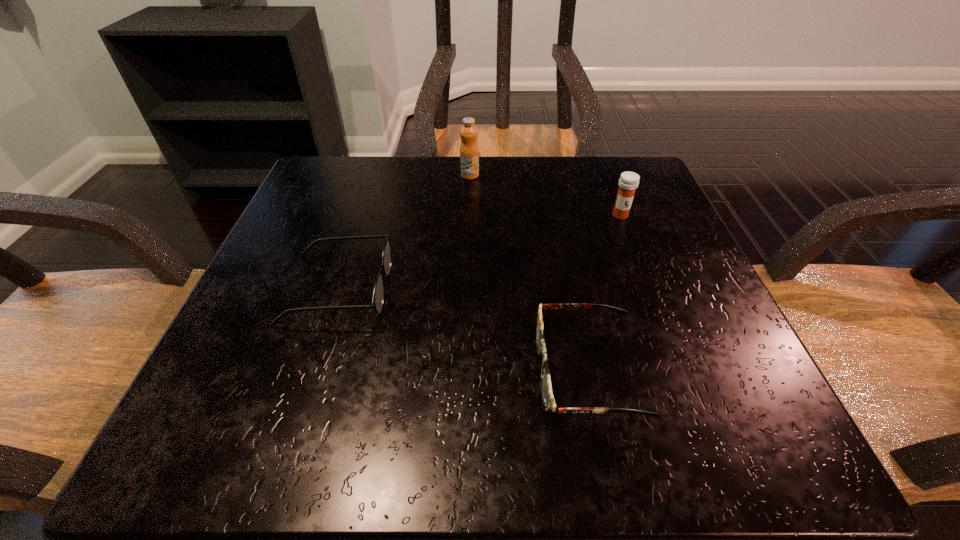
Identify the location of free space at the far edge. Image resolution: width=960 pixels, height=540 pixels. (521, 199).

The width and height of the screenshot is (960, 540). In order to click on blank space at the left edge of the desktop in this screenshot , I will do `click(244, 357)`.

Image resolution: width=960 pixels, height=540 pixels. I want to click on vacant area at the right edge, so click(x=732, y=380).

In the image, there is a desktop. Where is `free region at the far left corner`? This screenshot has height=540, width=960. free region at the far left corner is located at coordinates (348, 188).

At what (x,y) coordinates should I click in order to perform the action: click on vacant space at the far right corner of the desktop. Please return your answer as a coordinate pair (x, y). This screenshot has height=540, width=960. Looking at the image, I should click on (609, 163).

This screenshot has width=960, height=540. I want to click on empty space that is in between the farthest object and the leftmost object, so click(x=404, y=232).

Locate an element on the screen. The image size is (960, 540). empty space that is in between the right spectacles and the second object from left to right is located at coordinates (529, 273).

What are the coordinates of `vacant region between the right spectacles and the medicine` in the screenshot? It's located at (604, 293).

Locate an element on the screen. The image size is (960, 540). vacant space in between the second object from right to left and the second tallest object is located at coordinates (604, 293).

At what (x,y) coordinates should I click in order to perform the action: click on free space between the second object from right to left and the second tallest object. Please return your answer as a coordinate pair (x, y). This screenshot has width=960, height=540. Looking at the image, I should click on (604, 293).